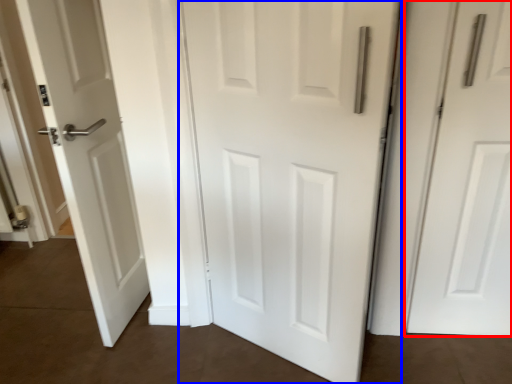
Question: Which point is closer to the camera, door (highlighted by a red box) or door (highlighted by a blue box)?

Choices:
 (A) door
 (B) door

Answer: (B)